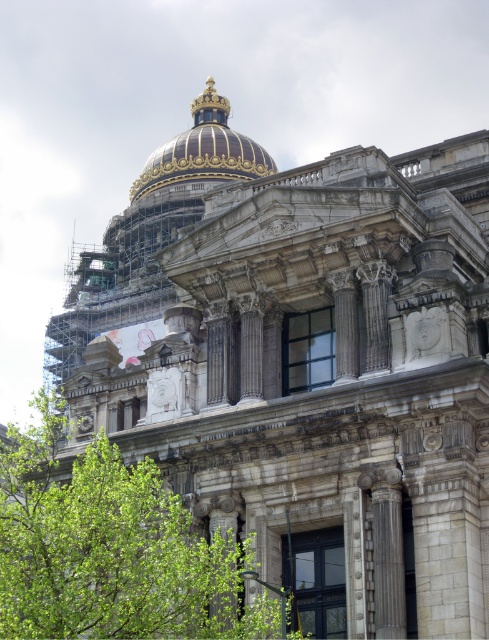
Identify the location of green leafy tree at center. The image size is (489, 640). click(x=111, y=548).

Describe the element at coordinates (111, 548) in the screenshot. I see `green leafy tree at center` at that location.

Is point (131, 548) positioned in front of point (215, 96)?

Yes, point (131, 548) is closer to viewer.

In order to click on green leafy tree at center in this screenshot , I will do `click(111, 548)`.